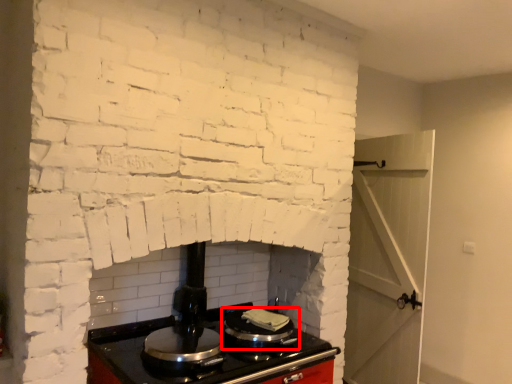
Question: In this image, where is kitchen appliance (annotated by the red box) located relative to appliance?

Choices:
 (A) left
 (B) right

Answer: (B)